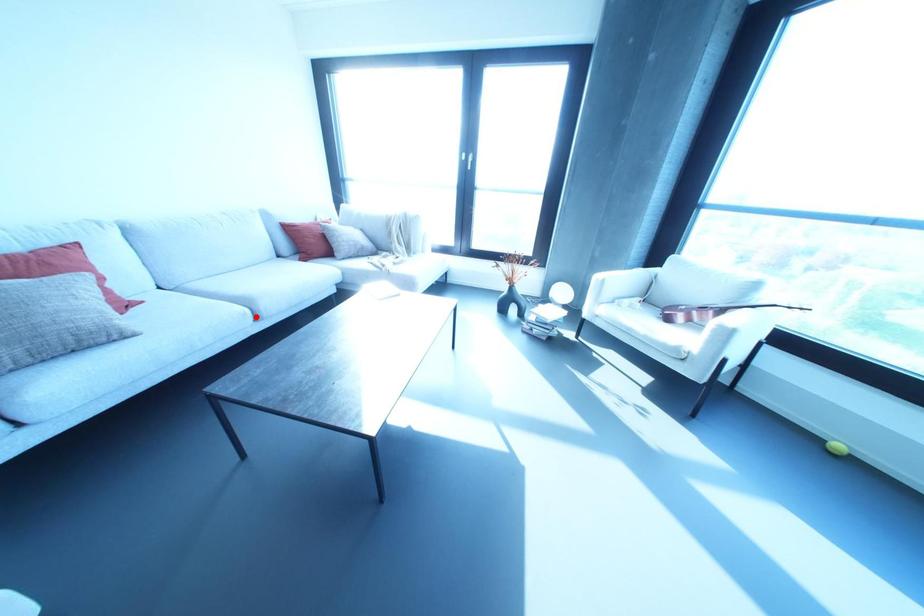
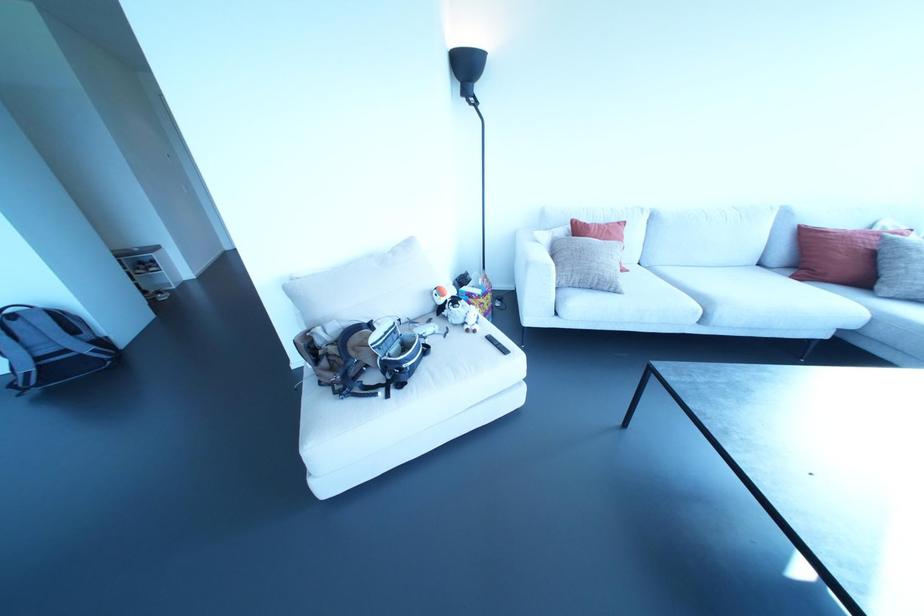
In the second image, find the point that corresponds to the highlighted location in the first image.

(701, 320)